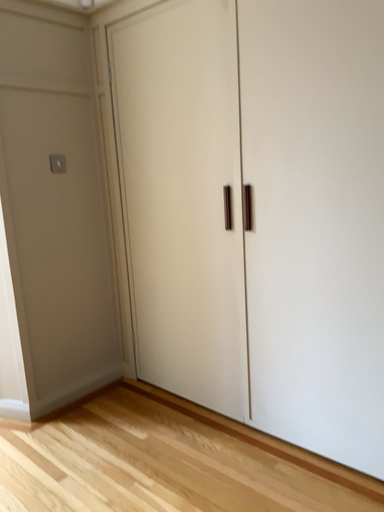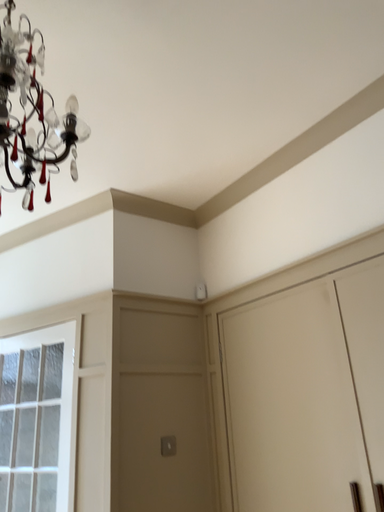
Question: Which way did the camera rotate in the video?

Choices:
 (A) rotated left
 (B) rotated right

Answer: (A)